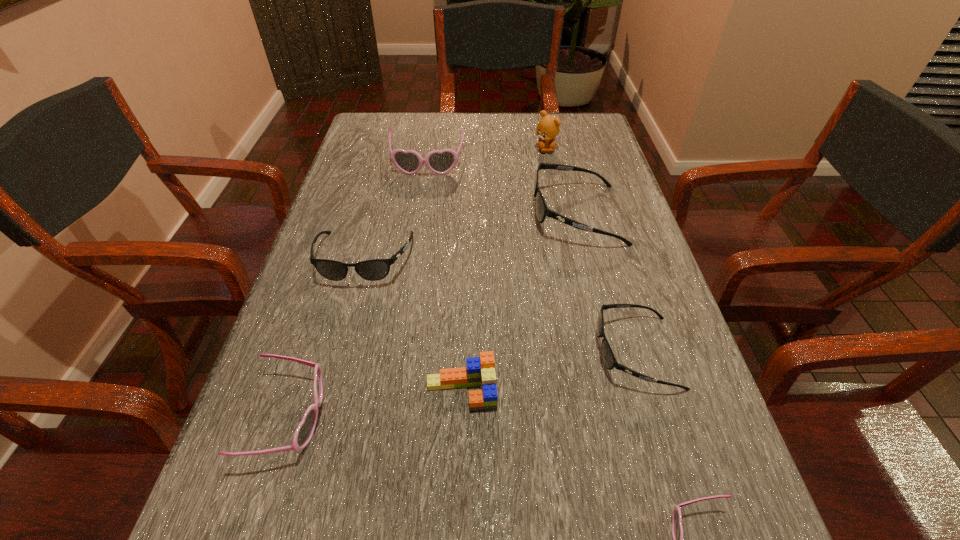
Identify which gray sunglasses is located as the nearest to the second nearest pink sunglasses. Please provide its 2D coordinates. Your answer should be formatted as a tuple, i.e. [(x, y)], where the tuple contains the x and y coordinates of a point satisfying the conditions above.

[(373, 270)]

Where is `the second closest gray sunglasses relative to the nearest gray sunglasses`? The width and height of the screenshot is (960, 540). the second closest gray sunglasses relative to the nearest gray sunglasses is located at coordinates (373, 270).

Where is `the closest pink sunglasses relative to the biggest pink sunglasses`? the closest pink sunglasses relative to the biggest pink sunglasses is located at coordinates (304, 432).

Identify which pink sunglasses is the third nearest to the Lego. Please provide its 2D coordinates. Your answer should be formatted as a tuple, i.e. [(x, y)], where the tuple contains the x and y coordinates of a point satisfying the conditions above.

[(410, 162)]

At what (x,y) coordinates should I click in order to perform the action: click on free space that satisfies the following two spatial constraints: 1. on the front-facing side of the orange Lego; 2. on the right side of the second smallest gray sunglasses. Please return your answer as a coordinate pair (x, y). Looking at the image, I should click on (329, 392).

The height and width of the screenshot is (540, 960). What are the coordinates of `free space that satisfies the following two spatial constraints: 1. on the front-facing side of the biggest gray sunglasses; 2. on the front-facing side of the leftmost gray sunglasses` in the screenshot? It's located at (588, 259).

At what (x,y) coordinates should I click in order to perform the action: click on vacant position in the image that satisfies the following two spatial constraints: 1. on the front-facing side of the farthest sunglasses; 2. on the front-facing side of the second biggest pink sunglasses. Please return your answer as a coordinate pair (x, y). This screenshot has height=540, width=960. Looking at the image, I should click on (389, 417).